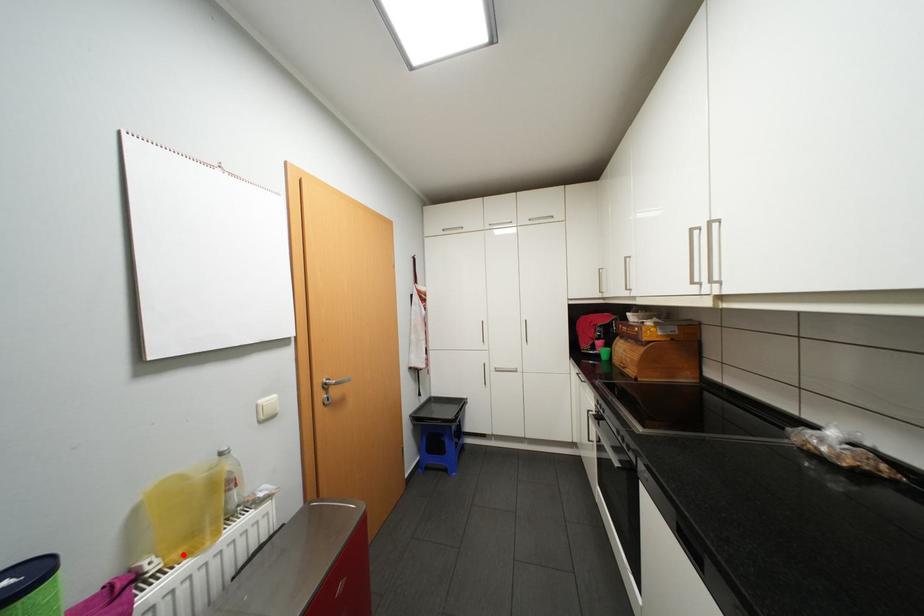
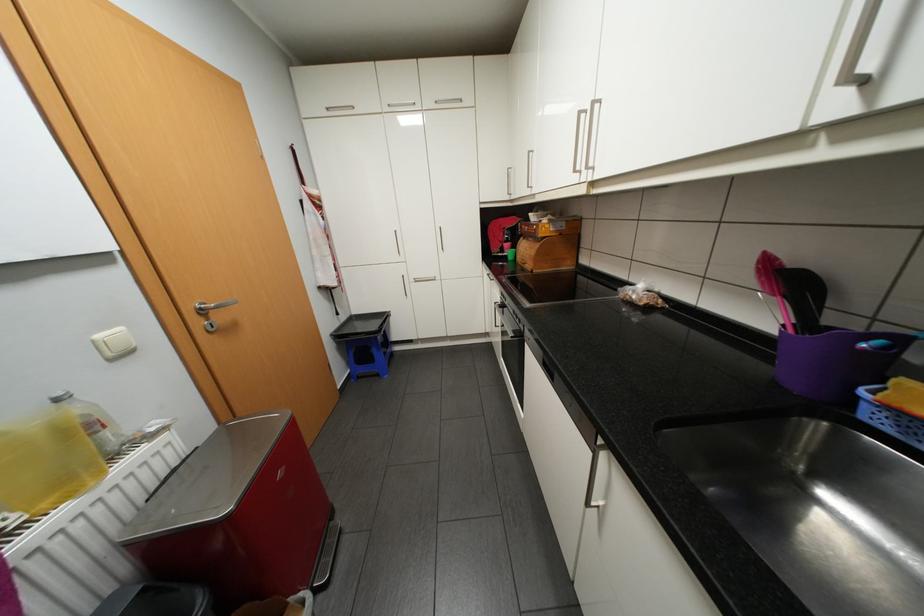
Question: I am providing you with two images of the same scene from different viewpoints. In image1, a red point is highlighted. Considering the same 3D point in image2, which of the following is correct?

Choices:
 (A) It is closer
 (B) It is farther

Answer: (B)